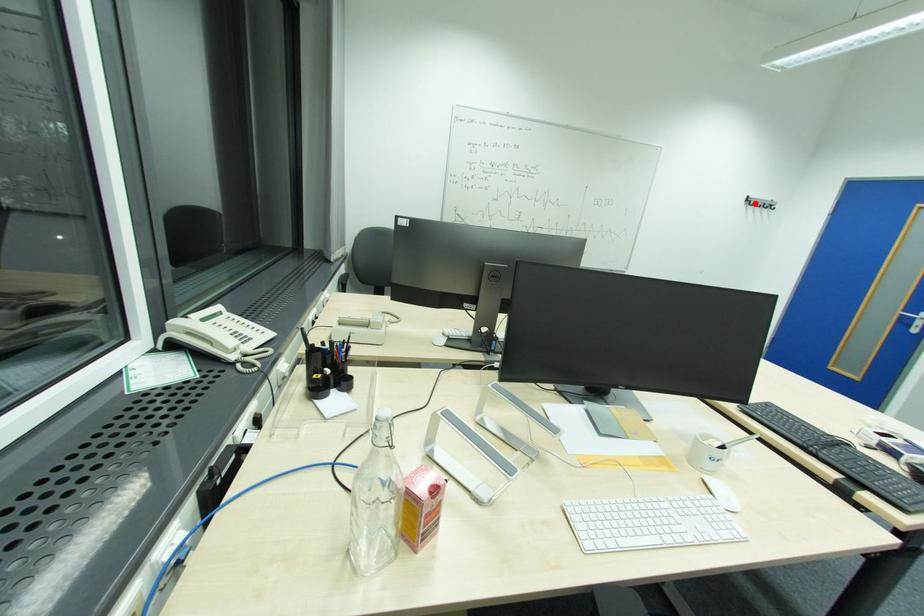
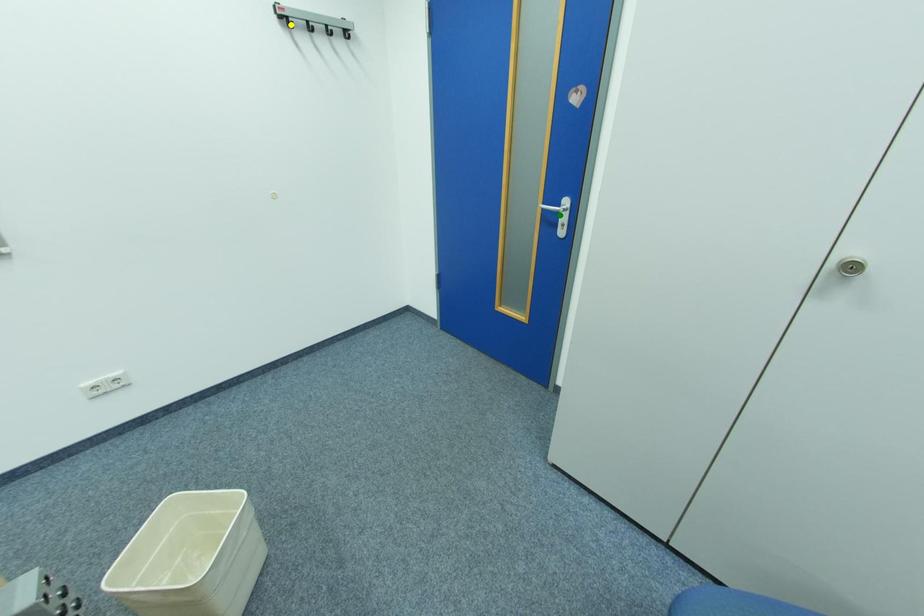
Question: I am providing you with two images of the same scene from different viewpoints. A red point is marked on the first image. You are given multiple points on the second image. Which point in image 2 is actually the same real-world point as the red point in image 1?

Choices:
 (A) blue point
 (B) yellow point
 (C) green point

Answer: (B)